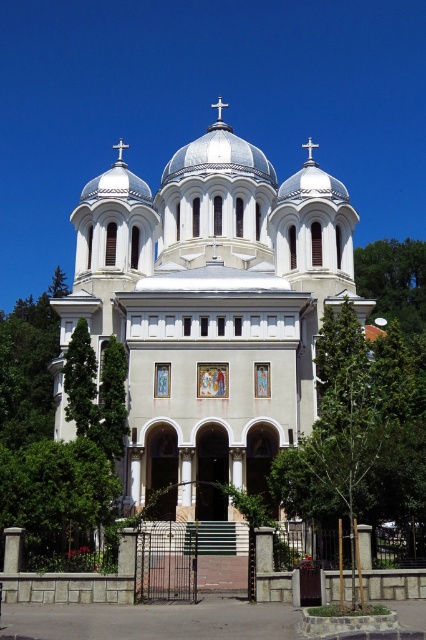
You are standing in front of the church and want to take a photo that includes both the green leafy tree at lower left and the green leafy tree at left. Which tree should you position closer to the center of the photo to ensure both are fully visible?

Since the green leafy tree at lower left is shorter than the green leafy tree at left, you should position the green leafy tree at lower left closer to the center of the photo to ensure both are fully visible.

You are standing in front of the church and want to take a photo that includes both the green leafy tree at lower left and the central dome. Based on their positions, which object should you focus on first to ensure both are in the frame?

The green leafy tree at lower left is located at point (55, 492), so you should focus on the central dome first to ensure both the tree and the dome are in the frame since the dome is centrally positioned and the tree is at the lower left corner.